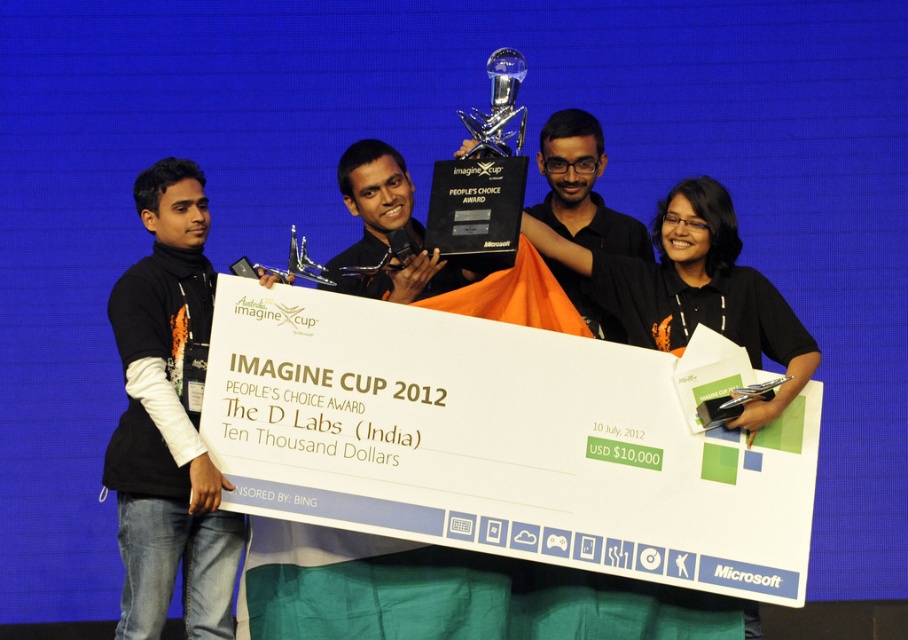
Is point (159, 595) farther from viewer compared to point (588, 170)?

That is False.

Where is `black turtleneck sweater at left`? This screenshot has width=908, height=640. black turtleneck sweater at left is located at coordinates (169, 420).

Can you confirm if black matte shirt at center is bigger than clear glass trophy at center?

Yes.

Who is more forward, [554,228] or [505,49]?

Positioned in front is point [505,49].

Find the location of a particular element. Image resolution: width=908 pixels, height=640 pixels. black matte shirt at center is located at coordinates (581, 188).

Can you confirm if black turtleneck sweater at left is positioned above clear glass trophy at center?

No, black turtleneck sweater at left is not above clear glass trophy at center.

Does black turtleneck sweater at left have a smaller size compared to clear glass trophy at center?

Indeed, black turtleneck sweater at left has a smaller size compared to clear glass trophy at center.

Is point (166, 164) more distant than point (476, 144)?

No, it is in front of (476, 144).

The width and height of the screenshot is (908, 640). Find the location of `black turtleneck sweater at left`. black turtleneck sweater at left is located at coordinates (169, 420).